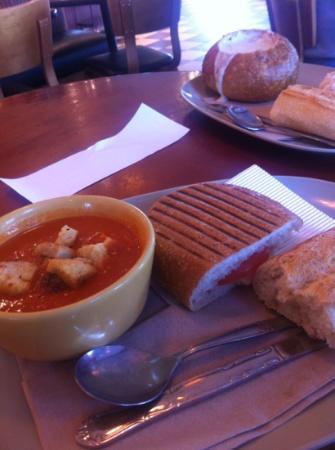
Locate an element on the screen. This screenshot has height=450, width=335. center bread bowl is located at coordinates (252, 44).